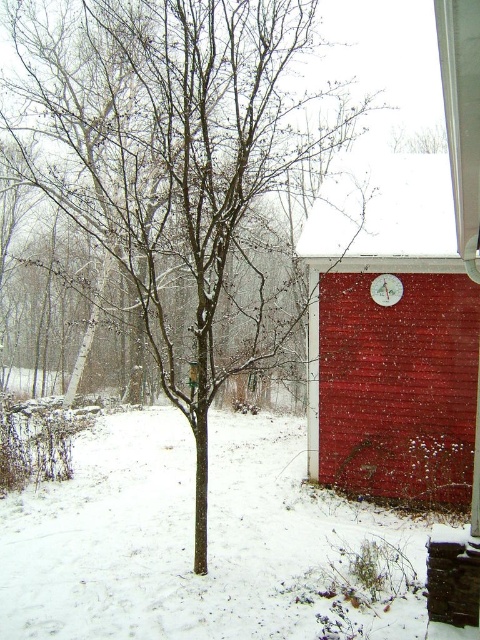
Is bare branches at center thinner than smooth red barn at center?

No.

Image resolution: width=480 pixels, height=640 pixels. I want to click on bare branches at center, so click(175, 161).